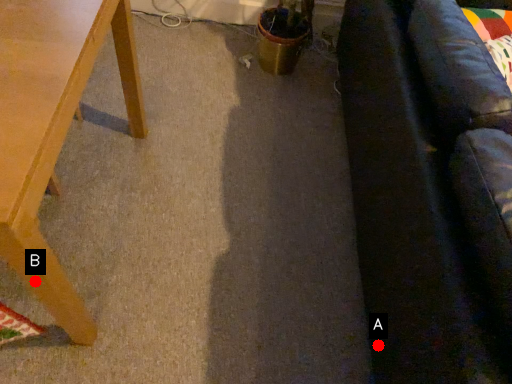
Question: Two points are circled on the image, labeled by A and B beside each circle. Among these points, which one is nearest to the camera?

Choices:
 (A) A is closer
 (B) B is closer

Answer: (B)